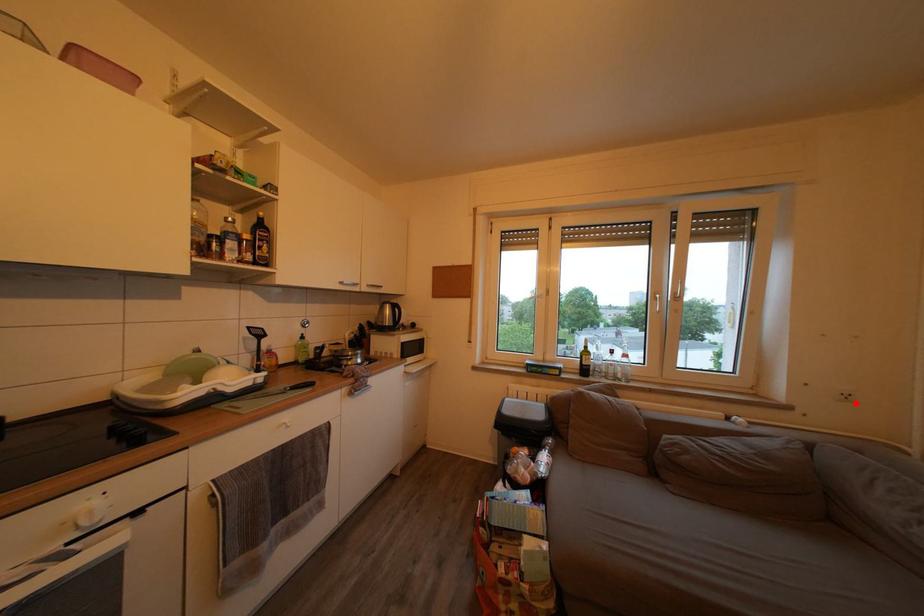
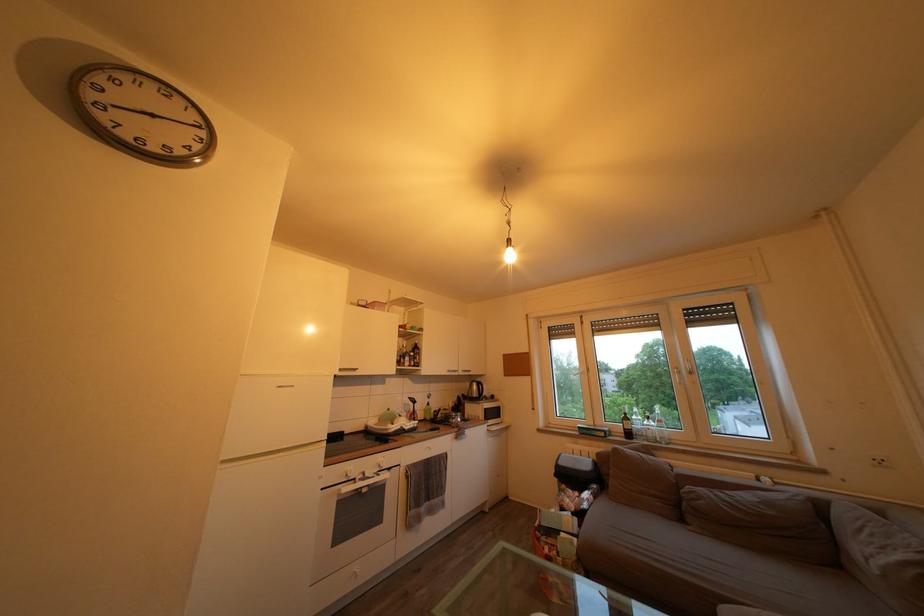
The point at the highlighted location is marked in the first image. Where is the corresponding point in the second image?

(889, 468)